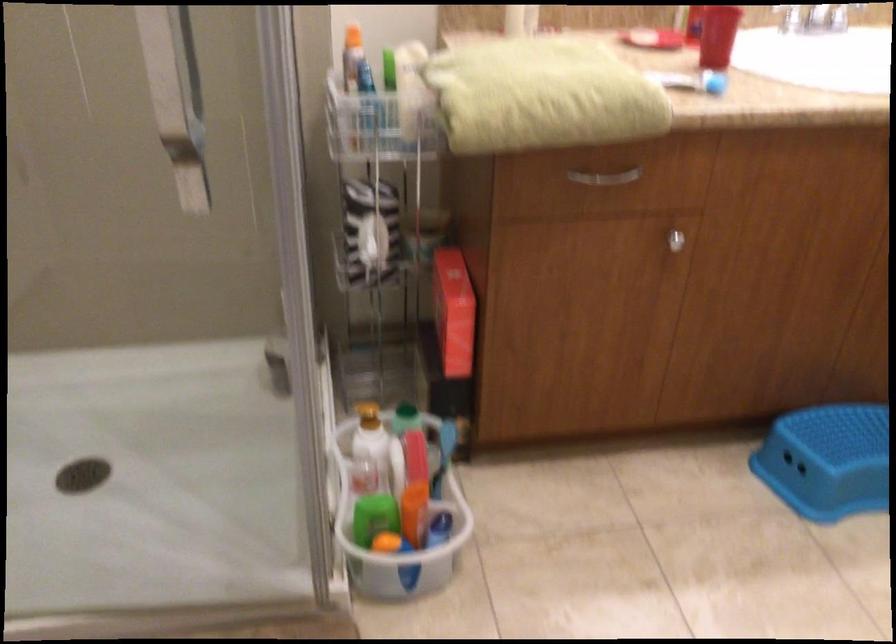
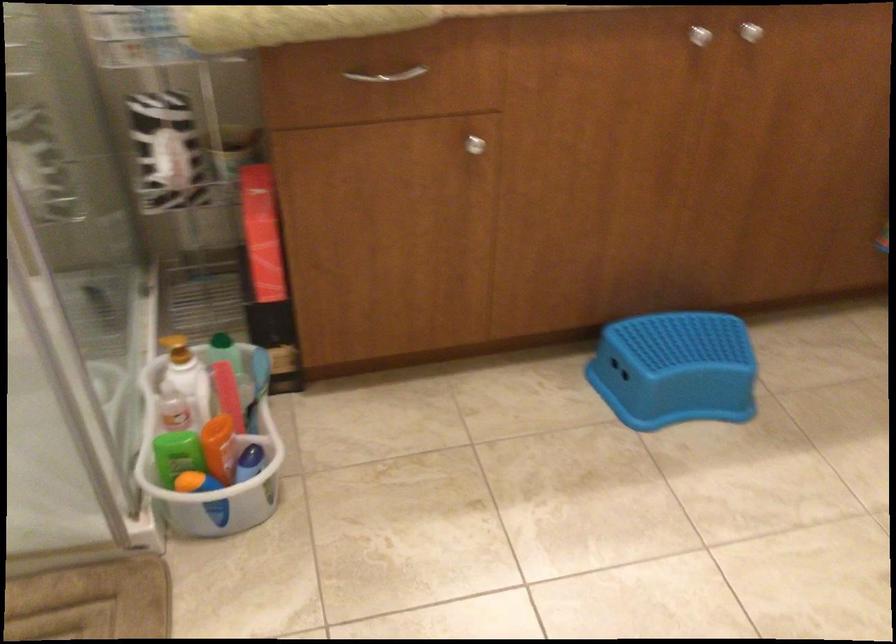
Locate, in the second image, the point that corresponds to (417,513) in the first image.

(220, 448)